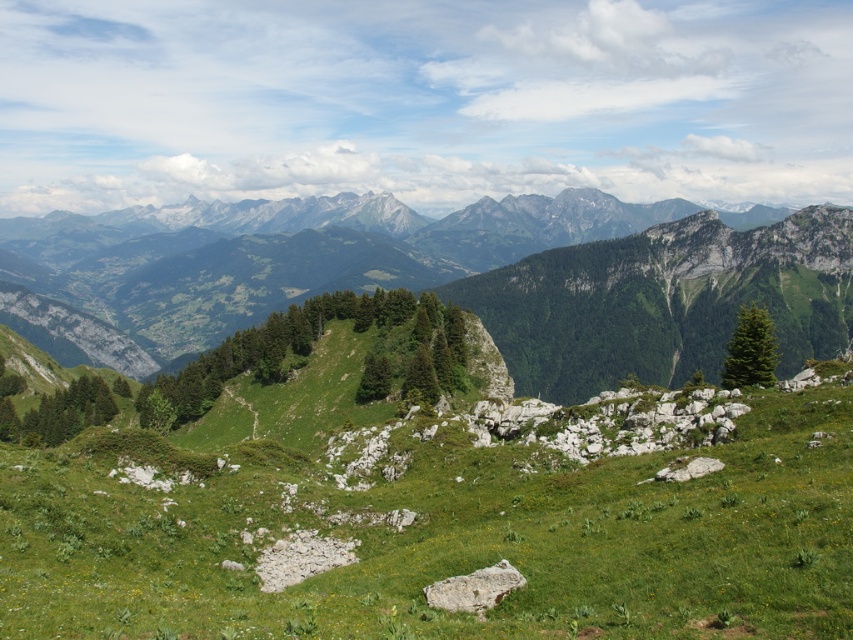
Question: Is green grassy hillside at center to the left of green grassy mountain range at upper center from the viewer's perspective?

Choices:
 (A) yes
 (B) no

Answer: (B)

Question: Can you confirm if green grassy hillside at center is smaller than green grassy mountain range at upper center?

Choices:
 (A) yes
 (B) no

Answer: (A)

Question: Does green grassy hillside at center have a larger size compared to green grassy mountain range at upper center?

Choices:
 (A) no
 (B) yes

Answer: (A)

Question: Which object is closer to the camera taking this photo?

Choices:
 (A) green grassy mountain range at upper center
 (B) green grassy hillside at center

Answer: (B)